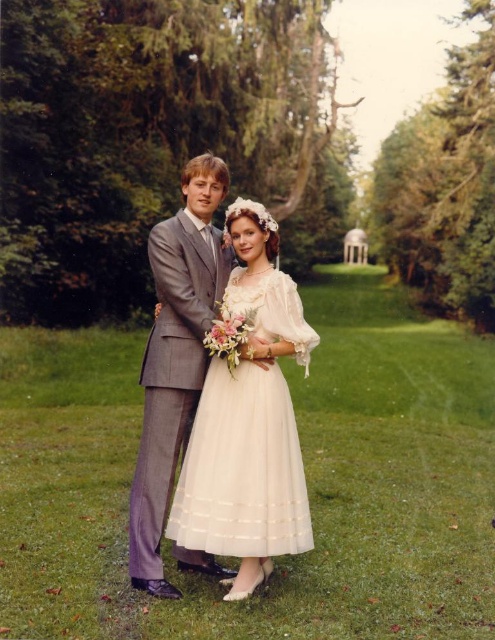
Is sheer white dress at center to the left of gray textured suit at center from the viewer's perspective?

No, sheer white dress at center is not to the left of gray textured suit at center.

Image resolution: width=495 pixels, height=640 pixels. What do you see at coordinates (243, 468) in the screenshot? I see `sheer white dress at center` at bounding box center [243, 468].

What are the coordinates of `sheer white dress at center` in the screenshot? It's located at (243, 468).